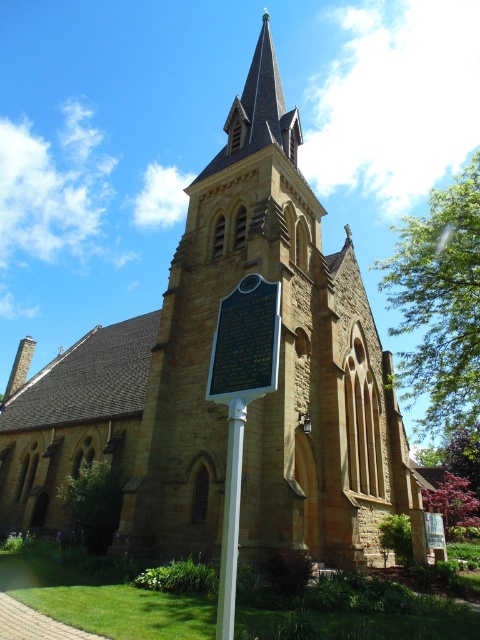
Question: Does silver metallic plaque at center appear on the left side of white plastic pole at center?

Choices:
 (A) yes
 (B) no

Answer: (B)

Question: Does silver metallic plaque at center have a smaller size compared to white plastic pole at center?

Choices:
 (A) no
 (B) yes

Answer: (B)

Question: Which of the following is the closest to the observer?

Choices:
 (A) (237, 346)
 (B) (231, 401)

Answer: (B)

Question: Which object appears farthest from the camera in this image?

Choices:
 (A) white plastic pole at center
 (B) silver metallic plaque at center

Answer: (B)

Question: Considering the relative positions of silver metallic plaque at center and white plastic pole at center in the image provided, where is silver metallic plaque at center located with respect to white plastic pole at center?

Choices:
 (A) left
 (B) right

Answer: (B)